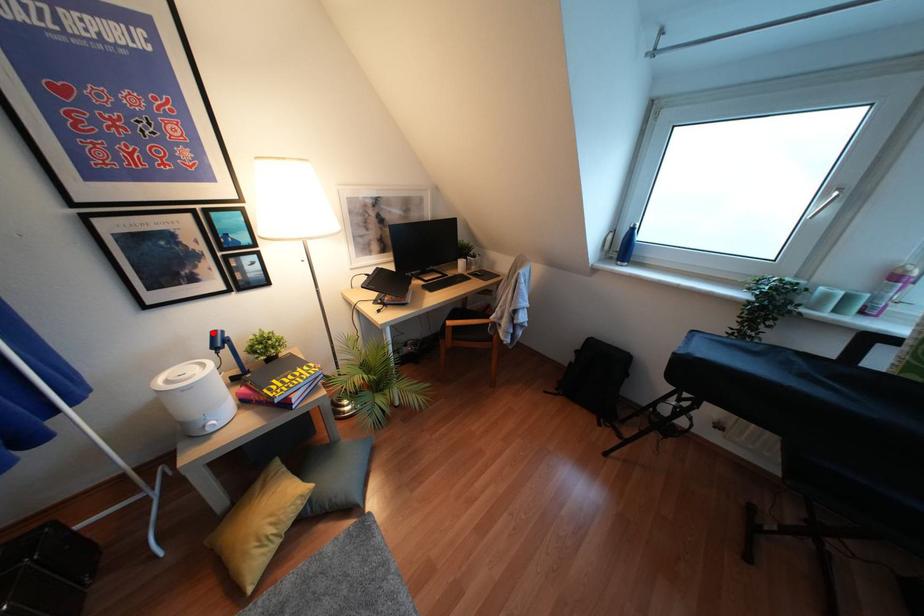
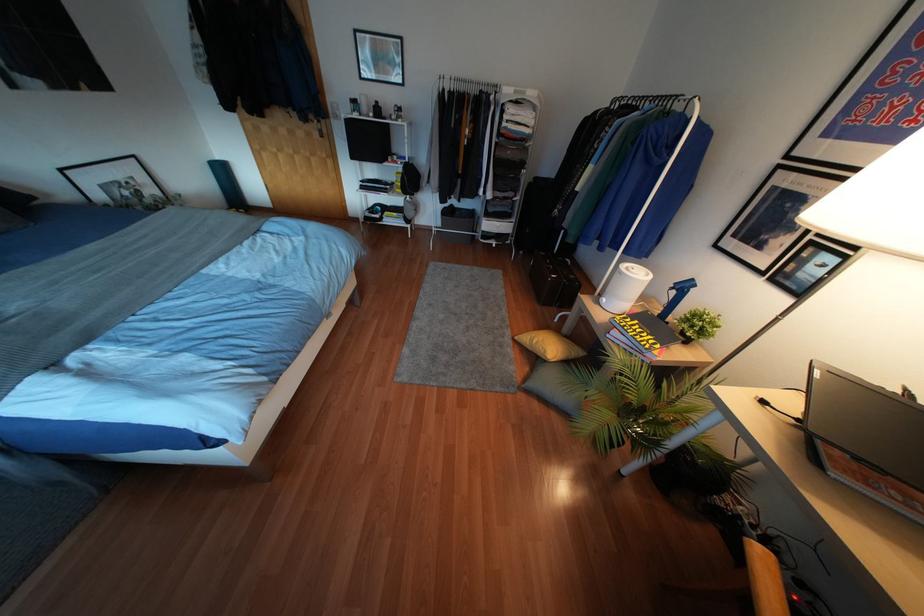
Where in the second image is the point corresponding to the highlighted location from the first image?

(690, 280)